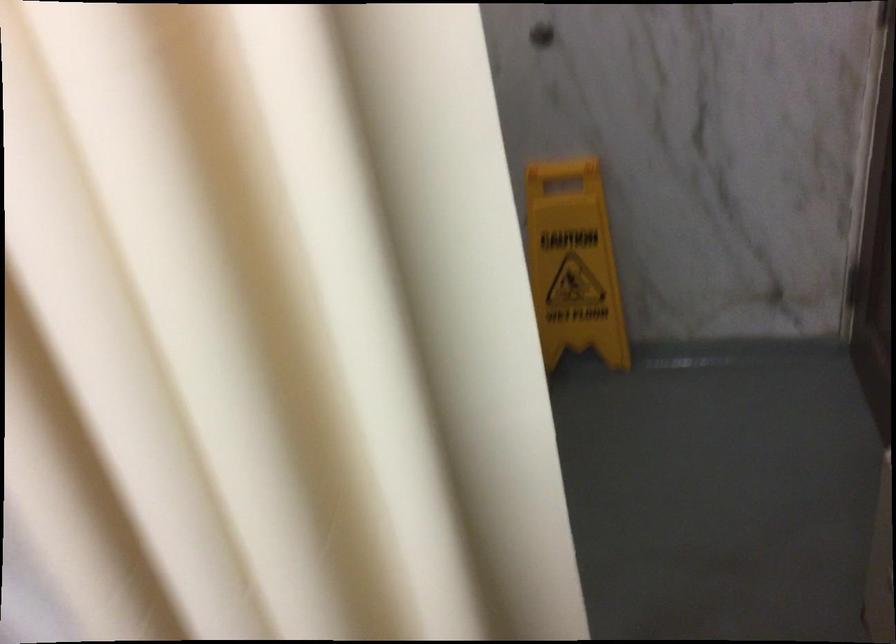
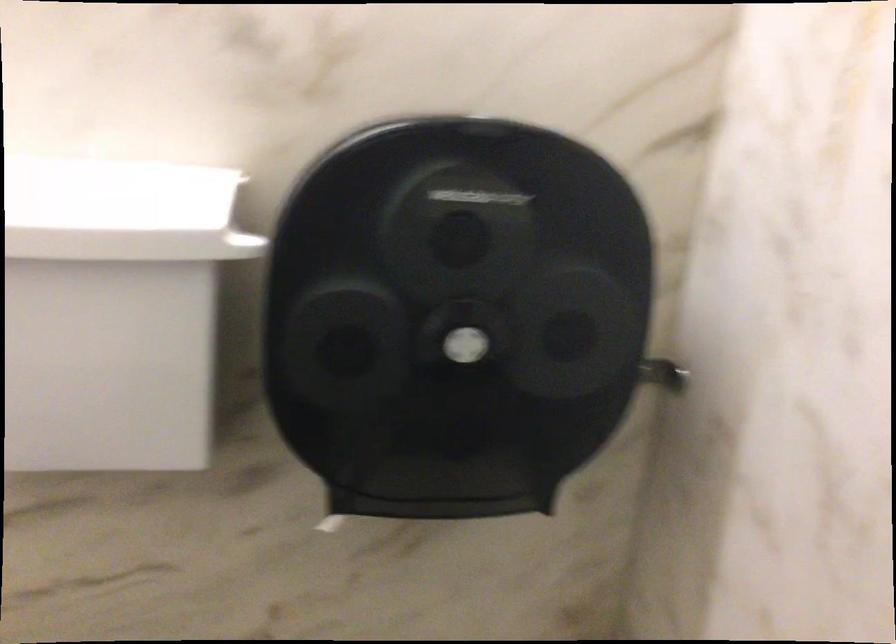
Question: The camera is either moving clockwise (left) or counter-clockwise (right) around the object. The first image is from the beginning of the video and the second image is from the end. Is the camera moving left or right when shooting the video?

Choices:
 (A) Left
 (B) Right

Answer: (B)